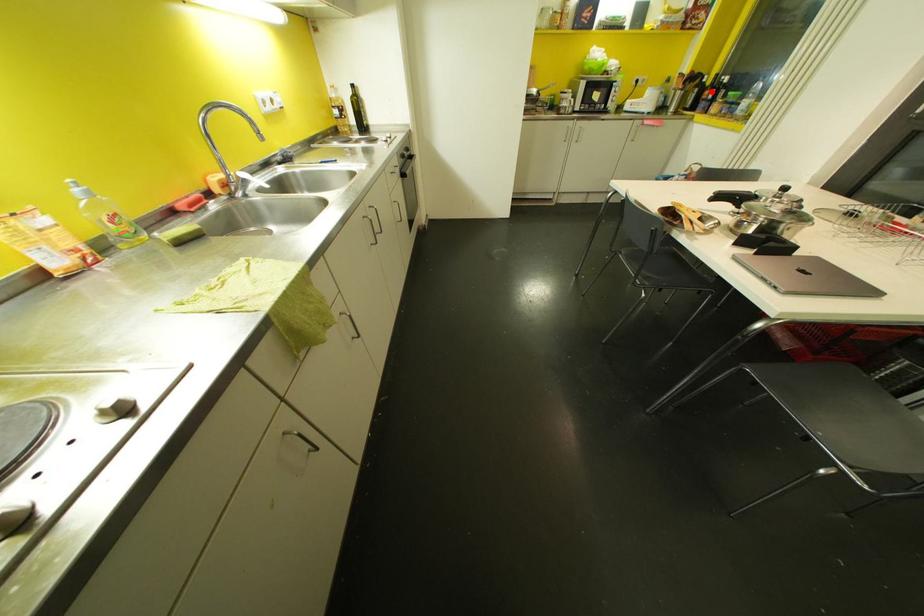
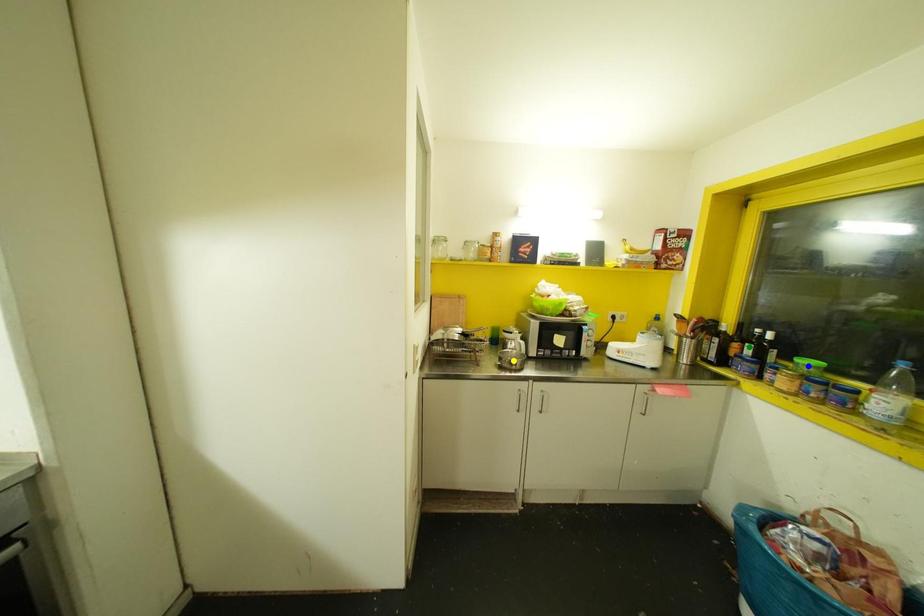
Question: I am providing you with two images of the same scene from different viewpoints. A red point is marked on the first image. You are given multiple points on the second image. Which point in image 2 is actually the same real-world point as the red point in image 1?

Choices:
 (A) yellow point
 (B) green point
 (C) blue point

Answer: (B)